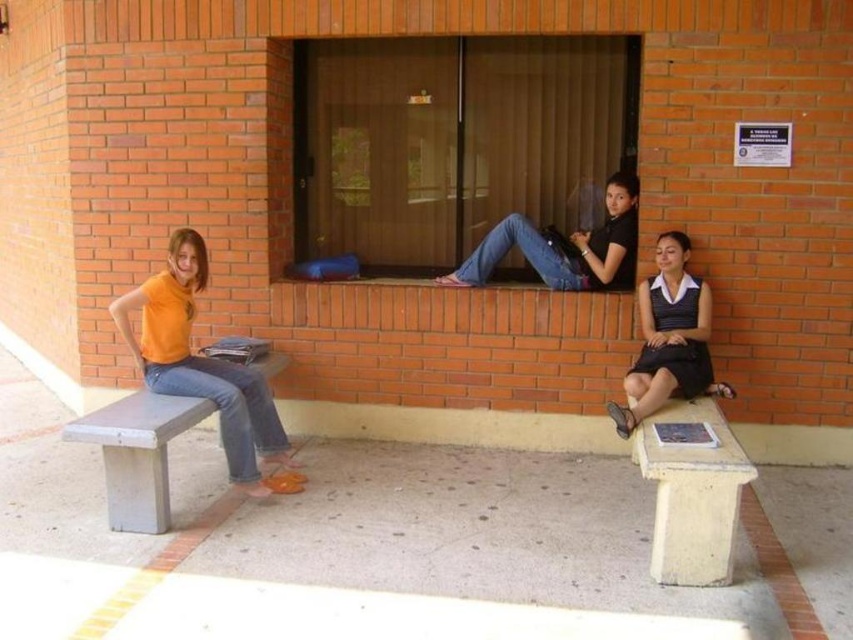
Who is more forward, (x=369, y=259) or (x=679, y=333)?

Point (x=679, y=333) is more forward.

Measure the distance from matte glass window at center to matte black dress at lower right.

matte glass window at center is 1.05 meters away from matte black dress at lower right.

Which is in front, point (462, 216) or point (660, 259)?

Positioned in front is point (660, 259).

At what (x,y) coordinates should I click in order to perform the action: click on matte glass window at center. Please return your answer as a coordinate pair (x, y). Looking at the image, I should click on (473, 157).

Identify the location of orange matte shirt at left. This screenshot has width=853, height=640. (202, 364).

The image size is (853, 640). I want to click on orange matte shirt at left, so click(202, 364).

Does point (695, 291) come in front of point (119, 435)?

No, (695, 291) is further to viewer.

Who is more distant from viewer, (x=665, y=332) or (x=103, y=442)?

The point (x=665, y=332) is behind.

At what (x,y) coordinates should I click in order to perform the action: click on matte black dress at lower right. Please return your answer as a coordinate pair (x, y). Image resolution: width=853 pixels, height=640 pixels. Looking at the image, I should click on (669, 339).